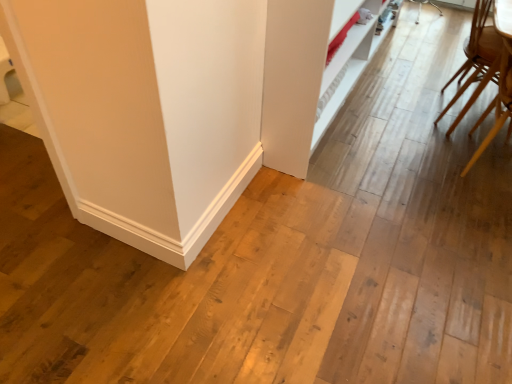
In order to click on free space that is to the left of light brown wooden chair at right in this screenshot , I will do `click(403, 119)`.